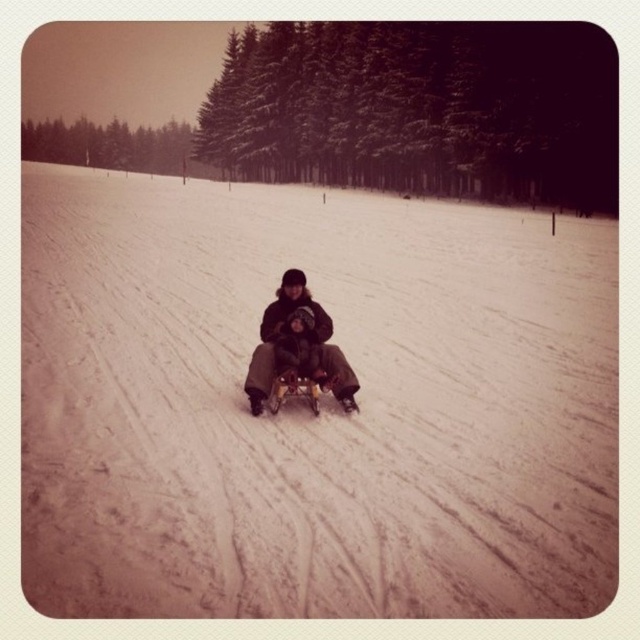
Question: Among these points, which one is farthest from the camera?

Choices:
 (A) (339, 348)
 (B) (51, 321)

Answer: (B)

Question: Is white powdery snow at center positioned at the back of dark brown fabric snowboard at center?

Choices:
 (A) yes
 (B) no

Answer: (B)

Question: Does white powdery snow at center appear on the right side of dark brown fabric snowboard at center?

Choices:
 (A) yes
 (B) no

Answer: (A)

Question: Does white powdery snow at center appear under dark brown fabric snowboard at center?

Choices:
 (A) yes
 (B) no

Answer: (B)